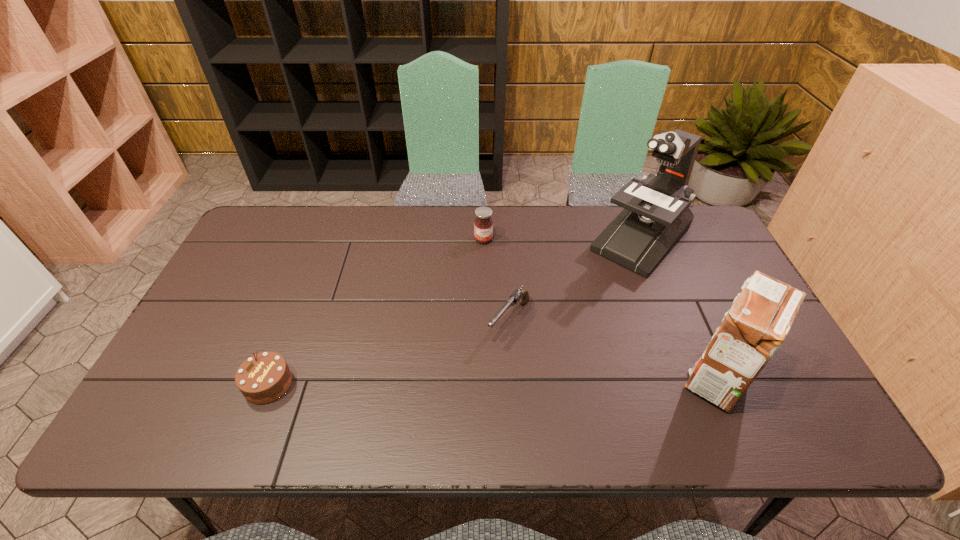
At what (x,y) coordinates should I click in order to perform the action: click on the leftmost object. Please return your answer as a coordinate pair (x, y). The height and width of the screenshot is (540, 960). Looking at the image, I should click on (265, 377).

You are a GUI agent. You are given a task and a screenshot of the screen. Output one action in this format:
    pyautogui.click(x=<x>, y=<y>)
    Task: Click on the fourth shortest object
    This screenshot has height=540, width=960.
    Given the screenshot: What is the action you would take?
    pyautogui.click(x=756, y=325)

What are the coordinates of `jam` in the screenshot? It's located at (483, 225).

You are a GUI agent. You are given a task and a screenshot of the screen. Output one action in this format:
    pyautogui.click(x=<x>, y=<y>)
    Task: Click on the gun
    This screenshot has height=540, width=960.
    Given the screenshot: What is the action you would take?
    pyautogui.click(x=522, y=295)

Locate an element on the screen. microscope is located at coordinates (656, 214).

Where is `vacant space located on the left of the chocolate cake`? vacant space located on the left of the chocolate cake is located at coordinates (204, 384).

Where is `free point located on the straw side of the second tallest object`? The height and width of the screenshot is (540, 960). free point located on the straw side of the second tallest object is located at coordinates (567, 378).

The height and width of the screenshot is (540, 960). What are the coordinates of `vacant space located on the straw side of the second tallest object` in the screenshot? It's located at (531, 378).

Where is `vacant space located 0.060m on the straw side of the second tallest object`? The image size is (960, 540). vacant space located 0.060m on the straw side of the second tallest object is located at coordinates (655, 378).

What are the coordinates of `free space located 0.300m on the label side of the jam` in the screenshot? It's located at (503, 317).